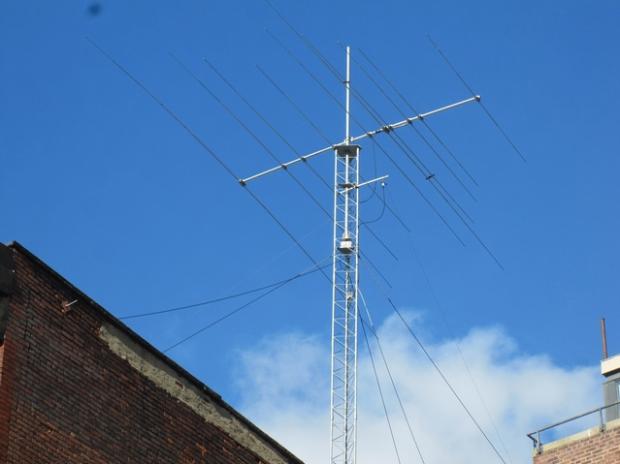
Locate an element on the screen. Image resolution: width=620 pixels, height=464 pixels. paint is located at coordinates (166, 373).